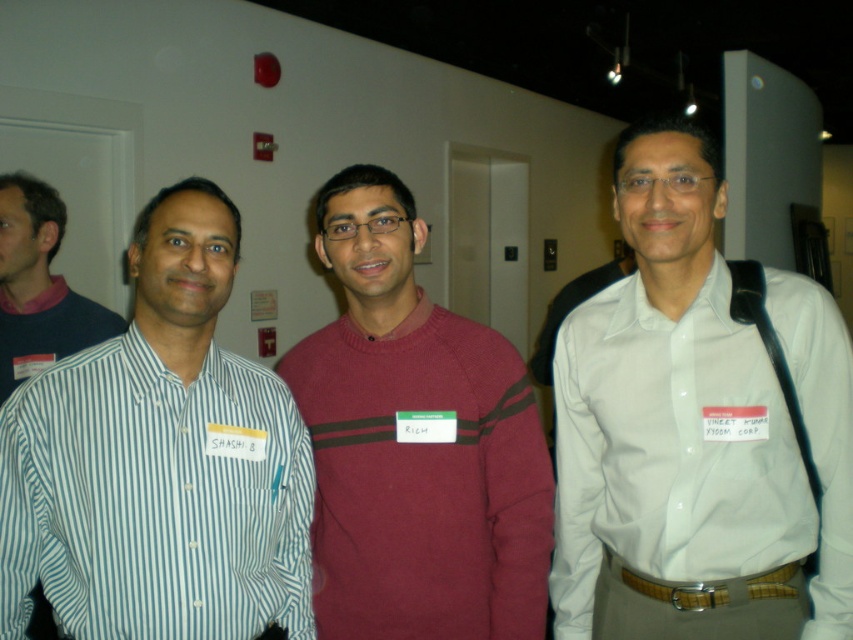
Who is positioned more to the right, maroon sweater at center or white cotton shirt at right?

Positioned to the right is white cotton shirt at right.

Between point (393, 374) and point (718, 268), which one is positioned in front?

Point (718, 268) is in front.

At what (x,y) coordinates should I click in order to perform the action: click on maroon sweater at center. Please return your answer as a coordinate pair (x, y). This screenshot has height=640, width=853. Looking at the image, I should click on (415, 444).

Where is `maroon sweater at center`? The width and height of the screenshot is (853, 640). maroon sweater at center is located at coordinates (415, 444).

Can you confirm if white cotton shirt at right is shorter than striped cotton shirt at left?

No.

Is point (672, 531) closer to camera compared to point (39, 257)?

Yes, point (672, 531) is in front of point (39, 257).

The width and height of the screenshot is (853, 640). What are the coordinates of `white cotton shirt at right` in the screenshot? It's located at (607, 445).

Is white striped shirt at left shorter than white cotton shirt at right?

Correct, white striped shirt at left is not as tall as white cotton shirt at right.

Who is taller, white striped shirt at left or white cotton shirt at right?

Standing taller between the two is white cotton shirt at right.

Which is in front, point (67, 620) or point (593, 330)?

Point (67, 620)

Where is `white striped shirt at left`? white striped shirt at left is located at coordinates (155, 499).